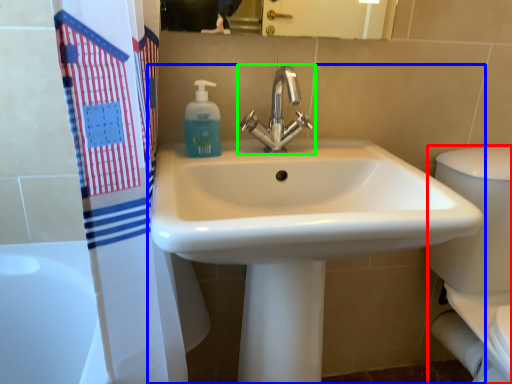
Question: Which object is positioned farthest from porcelain (highlighted by a red box)? Select from sink (highlighted by a blue box) and tap (highlighted by a green box).

Choices:
 (A) sink
 (B) tap

Answer: (B)